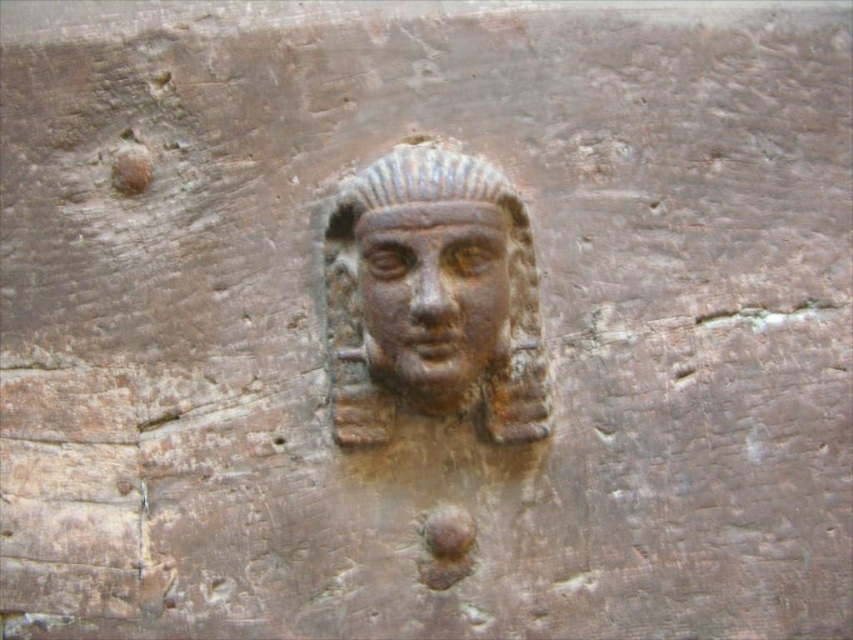
Who is more forward, (334,374) or (386,340)?

Point (386,340) is more forward.

Is rusty stone head at center closer to camera compared to rusty bronze face at center?

Yes, it is.

Identify the location of rusty stone head at center. (433, 298).